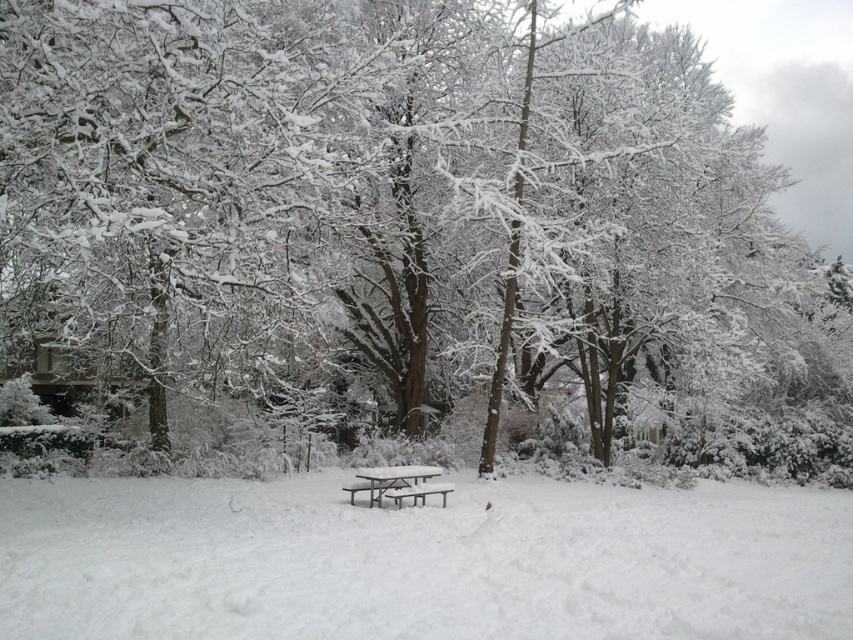
You are planning to place a 10 inches wide box between the white plastic picnic table at center and the metallic silver bench at center. Is there enough space for the box?

The distance between the white plastic picnic table at center and the metallic silver bench at center is 8.11 inches, which is less than the 10 inches width of the box. Therefore, the box cannot be placed between them.

You are standing at the edge of the winter scene and want to place a small snowman exactly at the center of the white matte snow at center. According to the coordinates provided, where should you place the snowman?

The white matte snow at center is located at coordinates point (421,561), so you should place the snowman precisely at that position.

You are planning to set up a small winter gathering and want to place a 1.2 meter long decoration between the white plastic picnic table at center and the metallic silver bench at center. Can the space between them accommodate this decoration?

The white plastic picnic table at center is bigger than the metallic silver bench at center. Therefore, the space between them is sufficient to place a 1.2 meter long decoration.